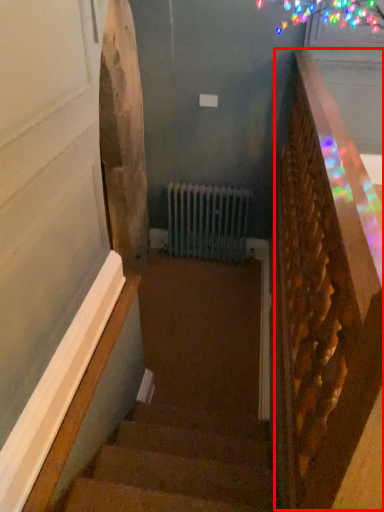
Question: Observing the image, what is the correct spatial positioning of rail (annotated by the red box) in reference to stairs?

Choices:
 (A) left
 (B) right

Answer: (B)